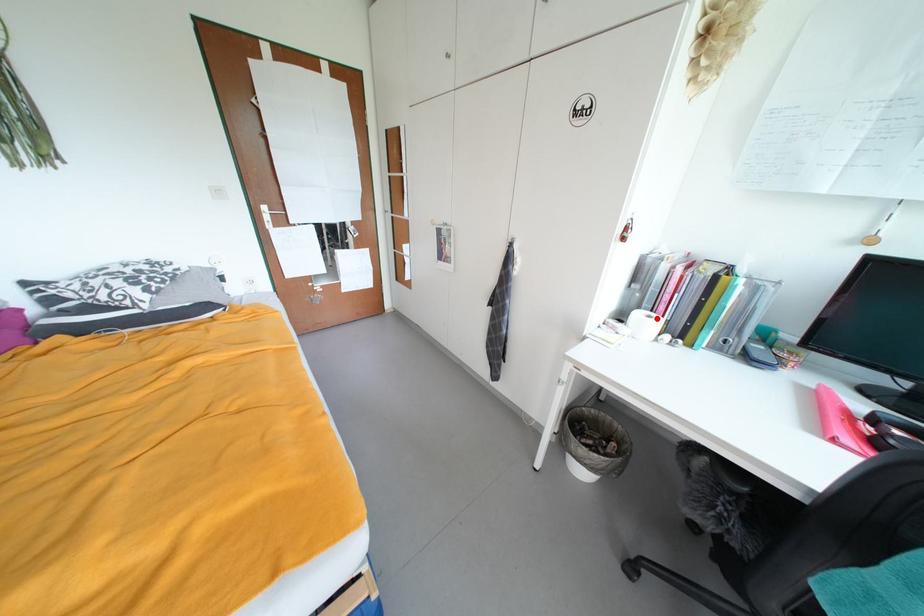
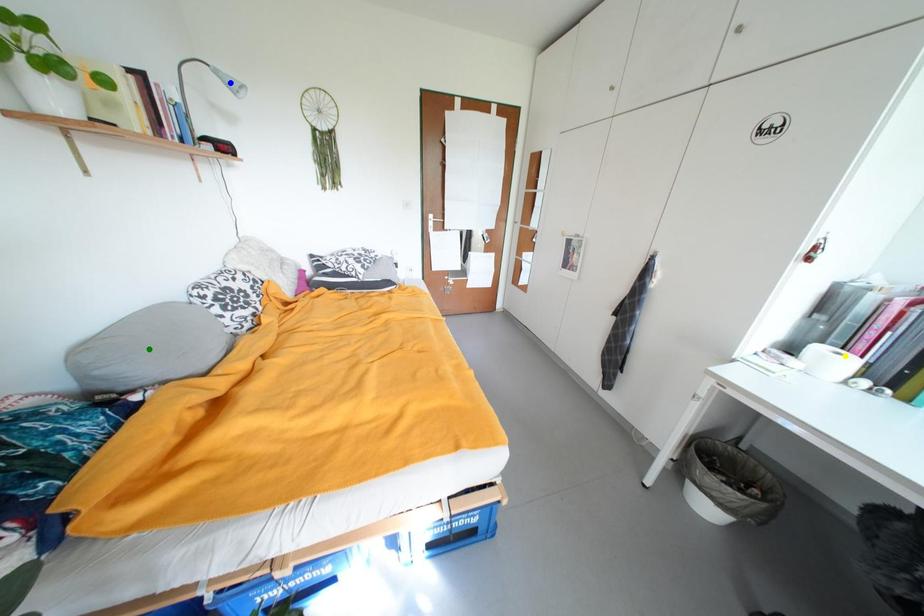
Question: I am providing you with two images of the same scene from different viewpoints. A red point is marked on the first image. You are given multiple points on the second image. Which spot in image 2 lines up with the point in image 1?

Choices:
 (A) green point
 (B) yellow point
 (C) blue point

Answer: (B)